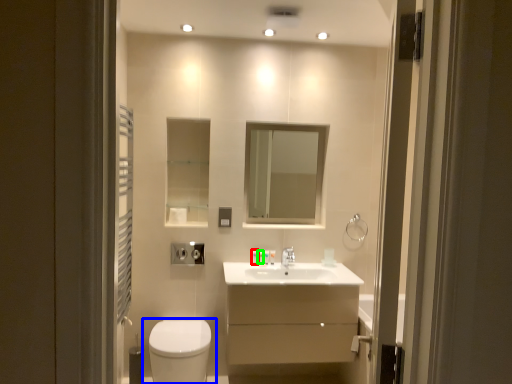
Question: Based on their relative distances, which object is farther from toiletry (highlighted by a red box)? Choose from toilet (highlighted by a blue box) and toiletry (highlighted by a green box).

Choices:
 (A) toilet
 (B) toiletry

Answer: (A)